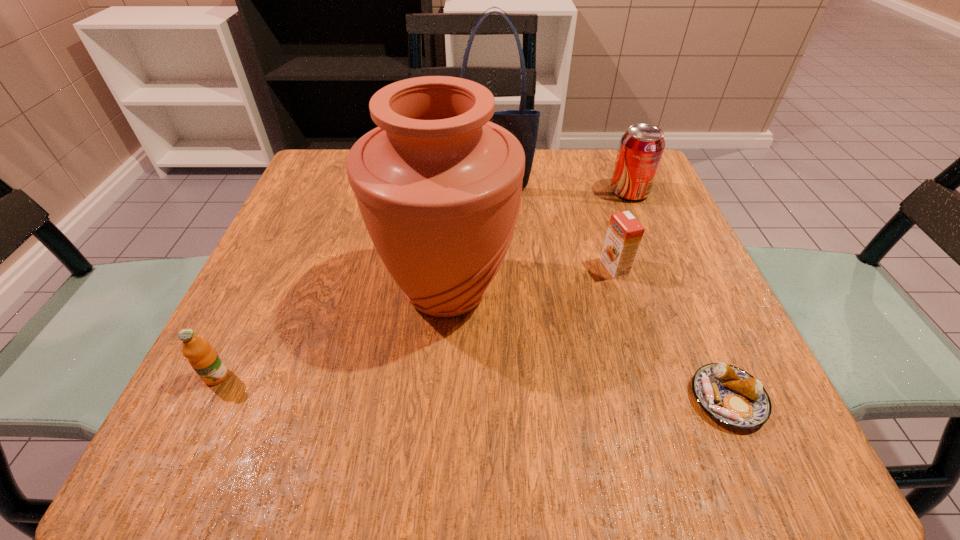
Identify the location of vacant area situated on the left of the fourth shortest object. This screenshot has width=960, height=540. (520, 192).

The width and height of the screenshot is (960, 540). What are the coordinates of `free space located 0.330m on the back of the farther orange juice` in the screenshot? It's located at [583, 165].

Locate an element on the screen. The height and width of the screenshot is (540, 960). free space located 0.100m on the label of the leftmost object is located at coordinates (179, 455).

Where is `vacant space located on the left of the shortest object`? This screenshot has height=540, width=960. vacant space located on the left of the shortest object is located at coordinates pyautogui.click(x=529, y=399).

The image size is (960, 540). What are the coordinates of `shopping bag positioned at the far edge` in the screenshot? It's located at (523, 124).

This screenshot has width=960, height=540. In order to click on soda can positioned at the far edge in this screenshot , I will do `click(641, 148)`.

Identify the location of object that is at the near edge. The width and height of the screenshot is (960, 540). (730, 395).

Locate an element on the screen. object that is at the left edge is located at coordinates (203, 358).

Find the location of a particular element. The image size is (960, 540). soda can located in the right edge section of the desktop is located at coordinates (641, 148).

Locate an element on the screen. orange juice that is at the right edge is located at coordinates (624, 234).